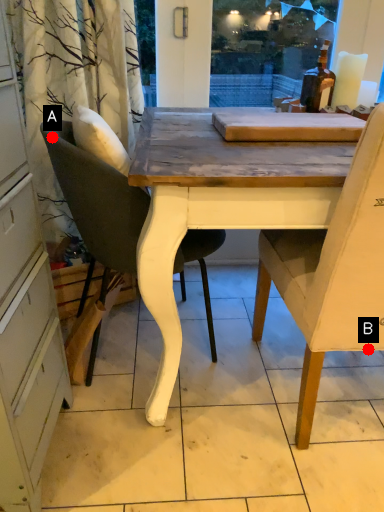
Question: Two points are circled on the image, labeled by A and B beside each circle. Which point is closer to the camera?

Choices:
 (A) A is closer
 (B) B is closer

Answer: (B)